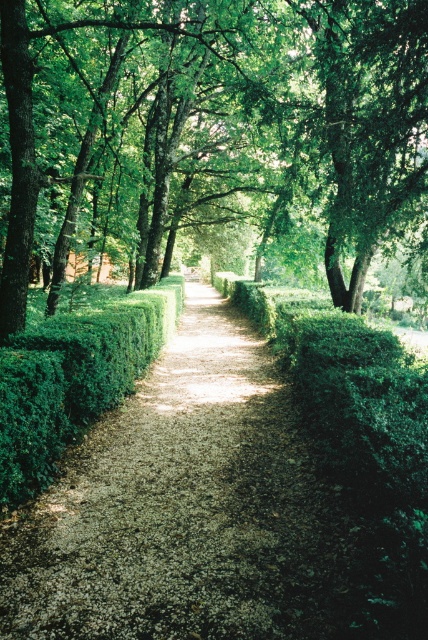
Question: Is green leafy tree at center positioned in front of green leafy hedge at center?

Choices:
 (A) no
 (B) yes

Answer: (A)

Question: Which object is positioned closest to the green leafy tree at center?

Choices:
 (A) green leafy hedge at center
 (B) green hedge at center

Answer: (A)

Question: Does green hedge at center have a lesser width compared to green leafy hedge at center?

Choices:
 (A) yes
 (B) no

Answer: (B)

Question: Is green hedge at center thinner than green leafy tree at center?

Choices:
 (A) no
 (B) yes

Answer: (B)

Question: Which point appears farthest from the camera in this image?

Choices:
 (A) (300, 152)
 (B) (41, 417)
 (C) (229, 476)

Answer: (A)

Question: Which of the following is the farthest from the observer?

Choices:
 (A) green leafy tree at center
 (B) green leafy hedge at center
 (C) green hedge at center

Answer: (A)